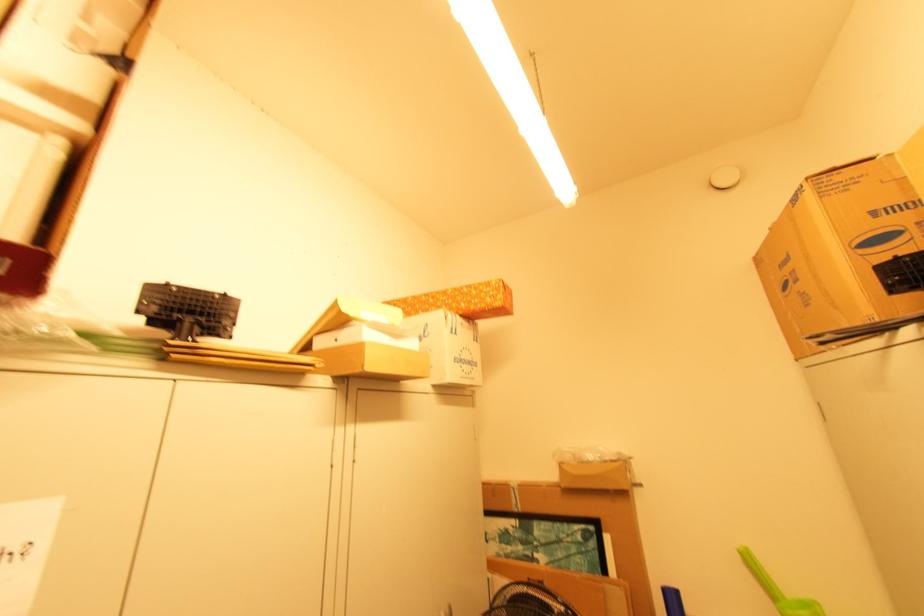
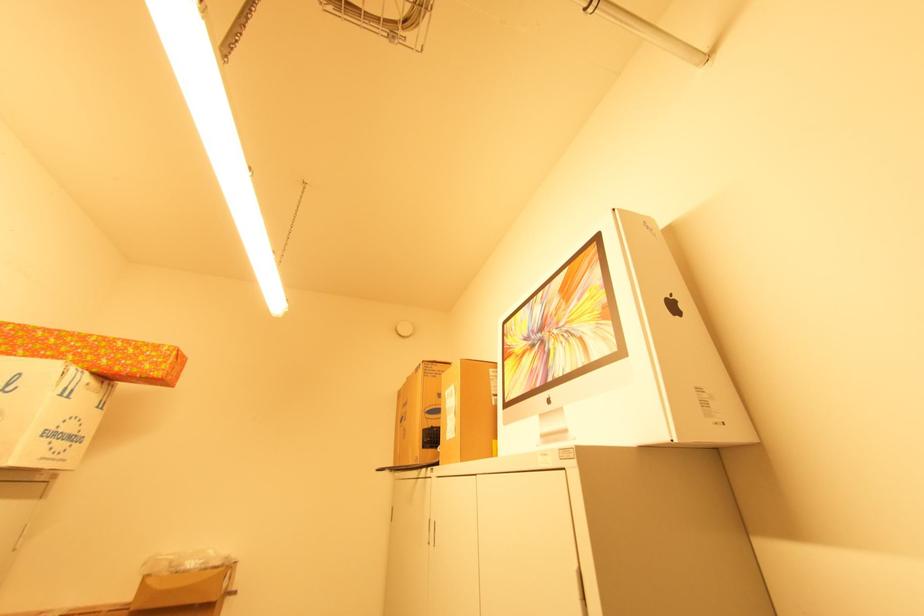
Based on the continuous images, in which direction is the camera rotating?

The camera's rotation is toward right-up.